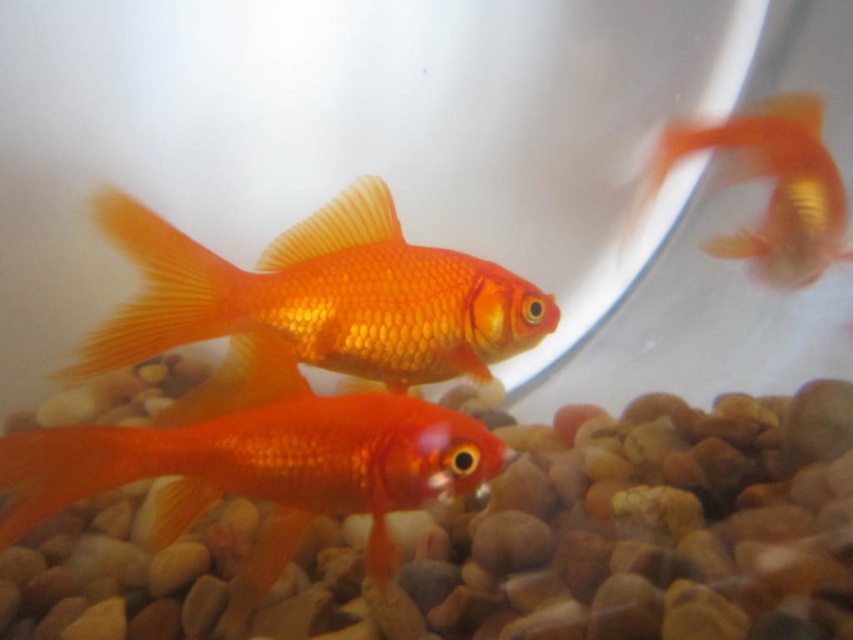
Does shiny orange fish at center appear on the left side of shiny orange goldfish at center?

Correct, you'll find shiny orange fish at center to the left of shiny orange goldfish at center.

What do you see at coordinates (259, 458) in the screenshot?
I see `shiny orange fish at center` at bounding box center [259, 458].

I want to click on shiny orange fish at center, so click(x=259, y=458).

Does shiny orange goldfish at center have a lesser width compared to shiny orange goldfish at upper right?

No, shiny orange goldfish at center is not thinner than shiny orange goldfish at upper right.

Which is more to the left, shiny orange goldfish at center or shiny orange goldfish at upper right?

From the viewer's perspective, shiny orange goldfish at center appears more on the left side.

The width and height of the screenshot is (853, 640). Identify the location of shiny orange goldfish at center. (321, 296).

Who is positioned more to the right, shiny orange fish at center or shiny orange goldfish at upper right?

shiny orange goldfish at upper right

Does shiny orange fish at center have a greater width compared to shiny orange goldfish at upper right?

Yes, shiny orange fish at center is wider than shiny orange goldfish at upper right.

Is point (283, 426) closer to viewer compared to point (775, 221)?

Yes.

Locate an element on the screen. shiny orange fish at center is located at coordinates (259, 458).